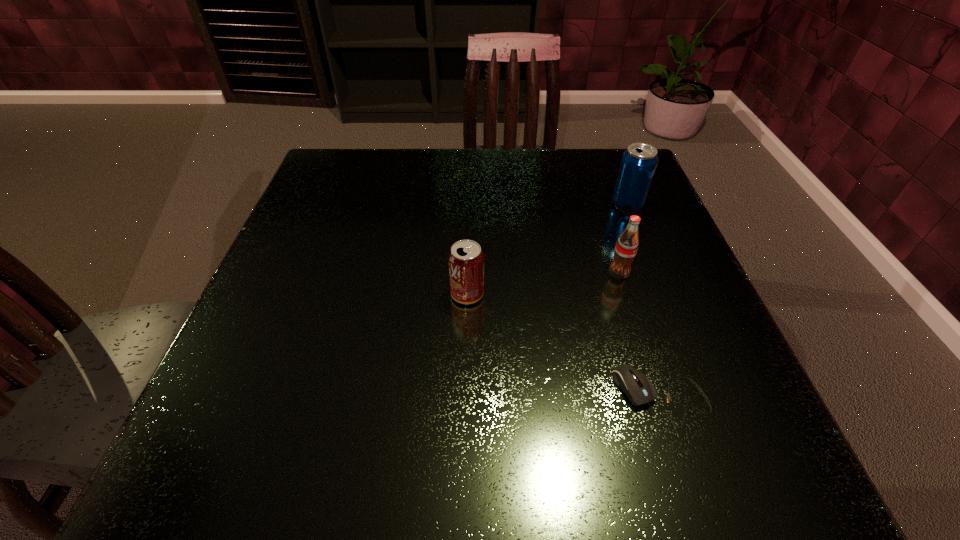
Image resolution: width=960 pixels, height=540 pixels. In order to click on the third closest object to the second nearest object in this screenshot , I will do `click(637, 168)`.

Point out which object is positioned as the second nearest to the second farthest soda can. Please provide its 2D coordinates. Your answer should be formatted as a tuple, i.e. [(x, y)], where the tuple contains the x and y coordinates of a point satisfying the conditions above.

[(638, 388)]

Where is `soda can object that ranks as the second closest to the second soda can from right to left`? This screenshot has height=540, width=960. soda can object that ranks as the second closest to the second soda can from right to left is located at coordinates (466, 259).

I want to click on the closest soda can to the third farthest object, so click(x=626, y=247).

This screenshot has height=540, width=960. Identify the location of blank area in the image that satisfies the following two spatial constraints: 1. on the front side of the computer mouse; 2. on the right side of the second nearest soda can. (659, 396).

The height and width of the screenshot is (540, 960). Find the location of `free space that satisfies the following two spatial constraints: 1. on the front side of the nearest object; 2. on the right side of the second shortest object`. free space that satisfies the following two spatial constraints: 1. on the front side of the nearest object; 2. on the right side of the second shortest object is located at coordinates (465, 396).

Where is `free space that satisfies the following two spatial constraints: 1. on the front side of the shortest soda can; 2. on the right side of the nearest object`? The width and height of the screenshot is (960, 540). free space that satisfies the following two spatial constraints: 1. on the front side of the shortest soda can; 2. on the right side of the nearest object is located at coordinates (465, 396).

Locate an element on the screen. vacant area in the image that satisfies the following two spatial constraints: 1. on the front side of the nearest object; 2. on the right side of the second soda can from left to right is located at coordinates (659, 396).